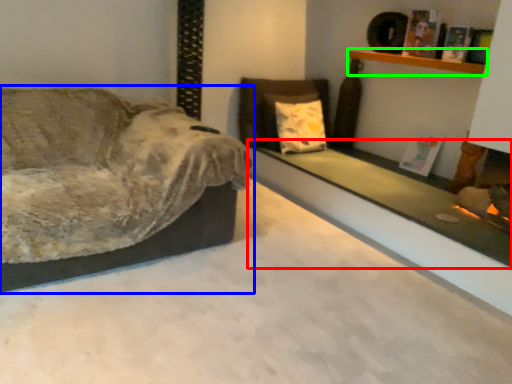
Question: Which is nearer to the ledge (highlighted by a red box)? studio couch (highlighted by a blue box) or shelf (highlighted by a green box).

Choices:
 (A) studio couch
 (B) shelf

Answer: (B)